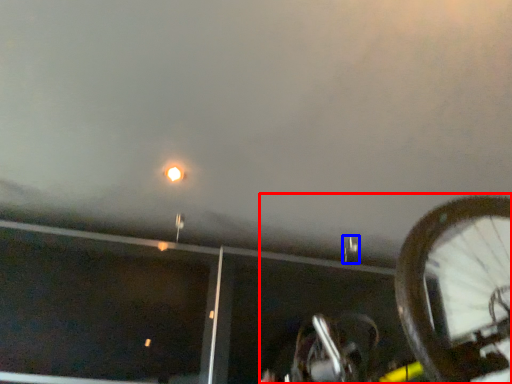
Question: Which object is closer to the camera taking this photo, bicycle (highlighted by a red box) or street light (highlighted by a blue box)?

Choices:
 (A) bicycle
 (B) street light

Answer: (A)